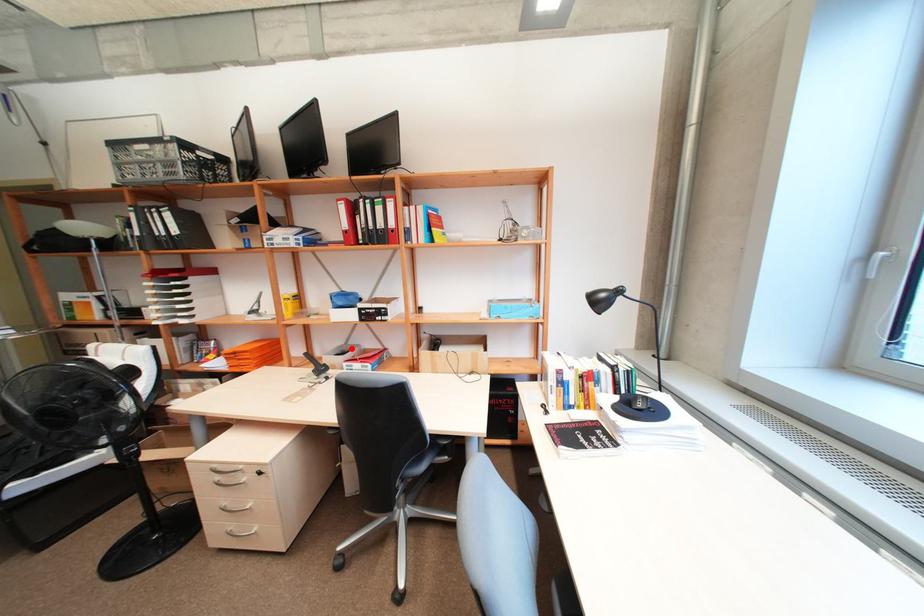
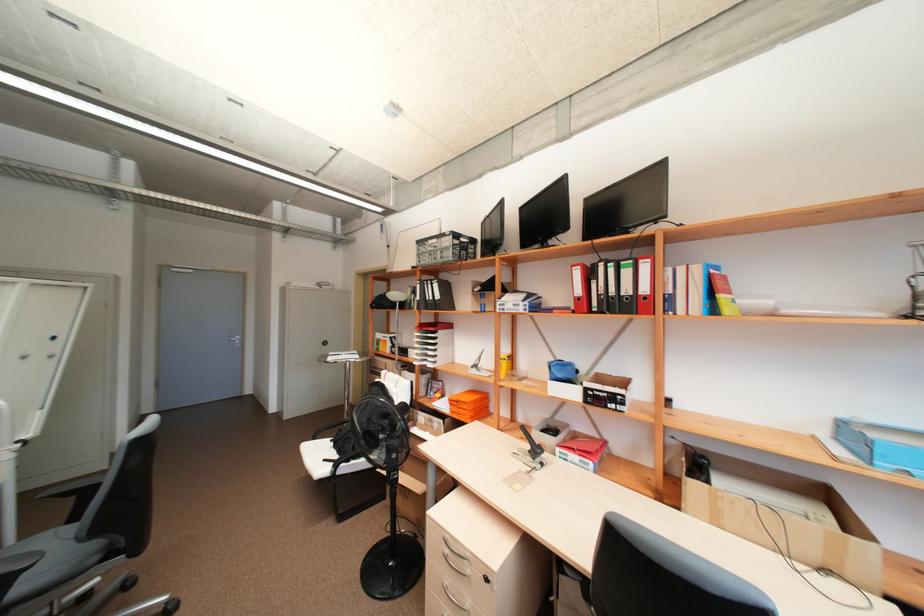
In the second image, find the point that corresponds to the highlighted location in the first image.

(557, 424)